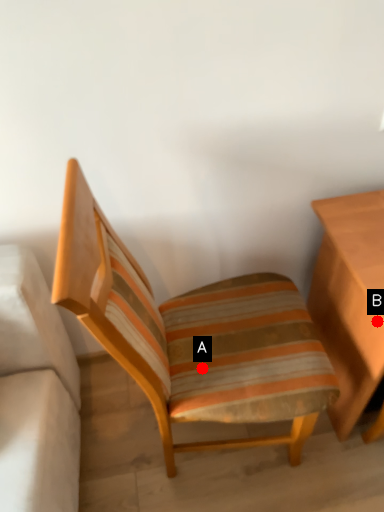
Question: Two points are circled on the image, labeled by A and B beside each circle. Which point is closer to the camera?

Choices:
 (A) A is closer
 (B) B is closer

Answer: (B)